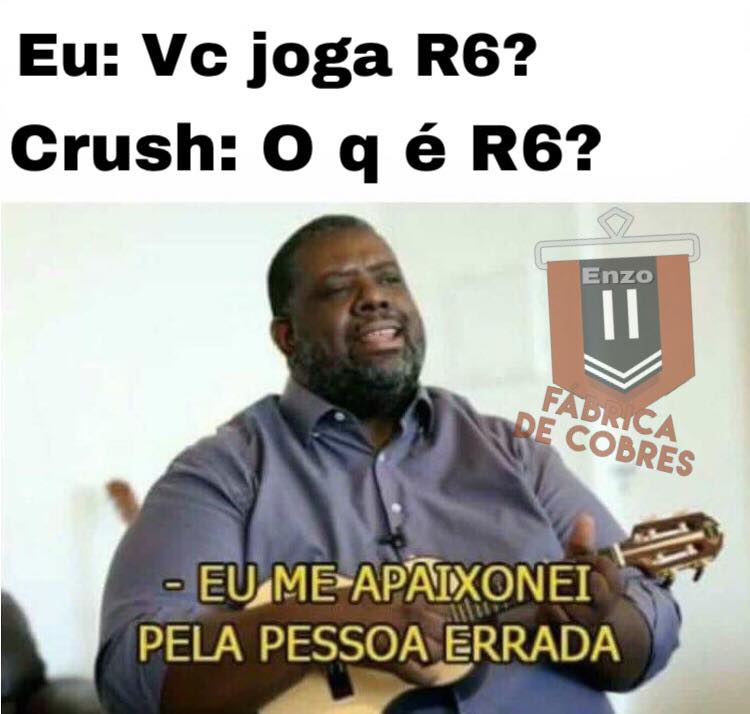
This screenshot has width=750, height=714. Find the location of `knobs`. knobs is located at coordinates coord(667,575), coord(697,565).